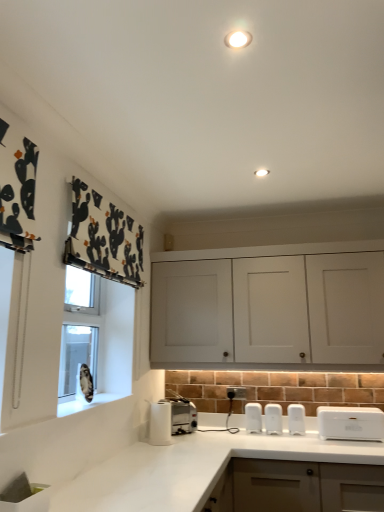
You are a GUI agent. You are given a task and a screenshot of the screen. Output one action in this format:
    pyautogui.click(x=<x>, y=<y>)
    Task: Click on the white marble countertop at lower center
    The height and width of the screenshot is (512, 384).
    Given the screenshot: What is the action you would take?
    pyautogui.click(x=193, y=469)

What do you see at coordinates (193, 469) in the screenshot?
I see `white marble countertop at lower center` at bounding box center [193, 469].

Measure the distance between white marble countertop at lower center and camera.

A distance of 5.19 feet exists between white marble countertop at lower center and camera.

Image resolution: width=384 pixels, height=512 pixels. What do you see at coordinates (269, 306) in the screenshot?
I see `white matte cabinet at center` at bounding box center [269, 306].

Where is `white matte cabinet at center`? white matte cabinet at center is located at coordinates (269, 306).

In order to face white matte cabinet at center, should I rotate leftwards or rightwards?

To face it directly, rotate right by 12.835 degrees.

Find the location of a particular element. white marble countertop at lower center is located at coordinates (193, 469).

Is white marble countertop at lower center to the left or to the right of white matte cabinet at center in the image?

In the image, white marble countertop at lower center appears on the left side of white matte cabinet at center.

Is the position of white marble countertop at lower center more distant than that of white matte cabinet at center?

No, it is in front of white matte cabinet at center.

Which is farther from the camera, (x=134, y=483) or (x=261, y=325)?

The point (x=261, y=325) is behind.

From the image's perspective, is white marble countertop at lower center above or below white matte cabinet at center?

Based on their image positions, white marble countertop at lower center is located beneath white matte cabinet at center.

From a real-world perspective, who is located lower, white marble countertop at lower center or white matte cabinet at center?

white marble countertop at lower center, from a real-world perspective.

Can you confirm if white marble countertop at lower center is wider than white matte cabinet at center?

Yes.

Is white marble countertop at lower center shorter than white matte cabinet at center?

No, white marble countertop at lower center is not shorter than white matte cabinet at center.

Considering the sizes of objects white marble countertop at lower center and white matte cabinet at center in the image provided, who is bigger, white marble countertop at lower center or white matte cabinet at center?

With larger size is white marble countertop at lower center.

Would you say white marble countertop at lower center is outside white matte cabinet at center?

Yes.

Are white marble countertop at lower center and white matte cabinet at center making contact?

No, white marble countertop at lower center is not making contact with white matte cabinet at center.

Could you tell me if white marble countertop at lower center is turned towards white matte cabinet at center?

No, white marble countertop at lower center does not turn towards white matte cabinet at center.

Can you tell me how much white marble countertop at lower center and white matte cabinet at center differ in facing direction?

90.1 degrees separate the facing orientations of white marble countertop at lower center and white matte cabinet at center.

Image resolution: width=384 pixels, height=512 pixels. What are the coordinates of `cabinetry that is on the right side of white marble countertop at lower center` in the screenshot? It's located at (269, 306).

Consider the image. Does white matte cabinet at center appear on the left side of white marble countertop at lower center?

In fact, white matte cabinet at center is to the right of white marble countertop at lower center.

Between white matte cabinet at center and white marble countertop at lower center, which one is positioned behind?

white matte cabinet at center is behind.

Which is in front, point (179, 353) or point (191, 489)?

The point (191, 489) is more forward.

From the image's perspective, is white matte cabinet at center under white marble countertop at lower center?

No, from the image's perspective, white matte cabinet at center is not beneath white marble countertop at lower center.

From a real-world perspective, is white matte cabinet at center above or below white marble countertop at lower center?

From a real-world perspective, white matte cabinet at center is physically above white marble countertop at lower center.

Considering the relative sizes of white matte cabinet at center and white marble countertop at lower center in the image provided, is white matte cabinet at center wider than white marble countertop at lower center?

In fact, white matte cabinet at center might be narrower than white marble countertop at lower center.

Between white matte cabinet at center and white marble countertop at lower center, which one has less height?

Standing shorter between the two is white matte cabinet at center.

Based on their sizes in the image, would you say white matte cabinet at center is bigger or smaller than white marble countertop at lower center?

Clearly, white matte cabinet at center is smaller in size than white marble countertop at lower center.

Is white matte cabinet at center inside the boundaries of white marble countertop at lower center, or outside?

white matte cabinet at center exists outside the volume of white marble countertop at lower center.

Would you say white matte cabinet at center is a long distance from white marble countertop at lower center?

They are positioned close to each other.

Could you tell me if white matte cabinet at center is facing white marble countertop at lower center?

No, white matte cabinet at center is not facing towards white marble countertop at lower center.

Find the location of `cabinetry positioned vertically above the white marble countertop at lower center (from a real-world perspective)`. cabinetry positioned vertically above the white marble countertop at lower center (from a real-world perspective) is located at coordinates (269, 306).

Identify the location of countertop lying on the left of white matte cabinet at center. (193, 469).

Locate an element on the screen. The height and width of the screenshot is (512, 384). cabinetry above the white marble countertop at lower center (from a real-world perspective) is located at coordinates (269, 306).